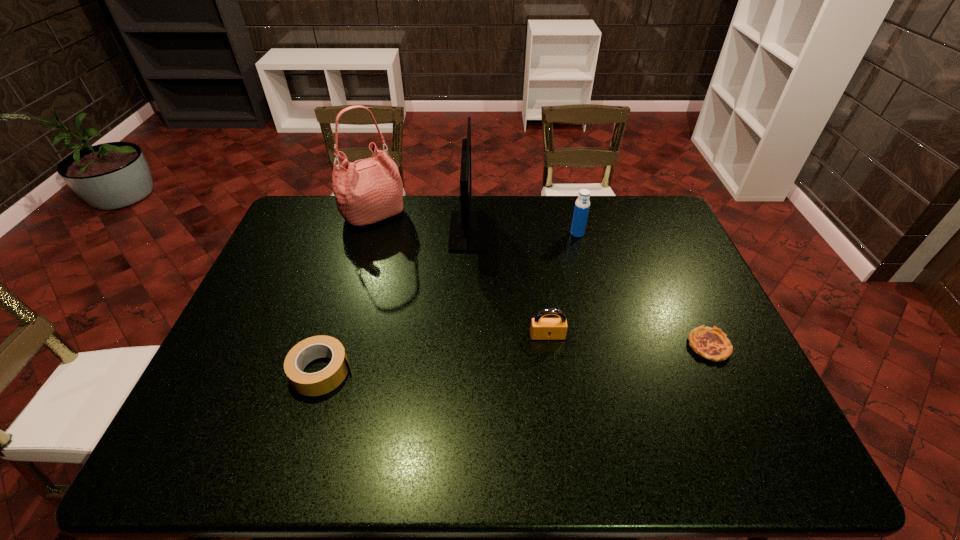
Locate an element on the screen. The image size is (960, 540). blank area located 0.250m on the right of the handbag is located at coordinates (476, 215).

This screenshot has width=960, height=540. In order to click on vacant space positioned on the screen side of the second tallest object in this screenshot , I will do `click(601, 232)`.

At what (x,y) coordinates should I click in order to perform the action: click on vacant point located on the front of the fifth object from left to right. Please return your answer as a coordinate pair (x, y). Looking at the image, I should click on (595, 303).

What are the coordinates of `vacant region located to unlock the third object from right to left from the front` in the screenshot? It's located at (563, 441).

At what (x,y) coordinates should I click in order to perform the action: click on vacant area situated at the edge of the duct tape. Please return your answer as a coordinate pair (x, y). This screenshot has height=540, width=960. Looking at the image, I should click on (460, 372).

Identify the location of vacant space situated 0.230m on the back of the shortest object. The height and width of the screenshot is (540, 960). (675, 272).

Identify the location of handbag that is at the far edge. (369, 190).

Locate an element on the screen. monitor at the far edge is located at coordinates (468, 229).

Where is `water bottle that is positioned at the far edge`? Image resolution: width=960 pixels, height=540 pixels. water bottle that is positioned at the far edge is located at coordinates (582, 204).

Where is `object that is at the right edge`? object that is at the right edge is located at coordinates (712, 344).